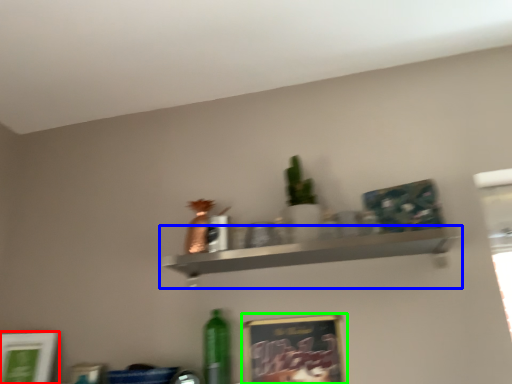
Question: Which object is positioned closest to picture frame (highlighted by a red box)? Select from shelf (highlighted by a blue box) and picture frame (highlighted by a green box).

Choices:
 (A) shelf
 (B) picture frame

Answer: (B)